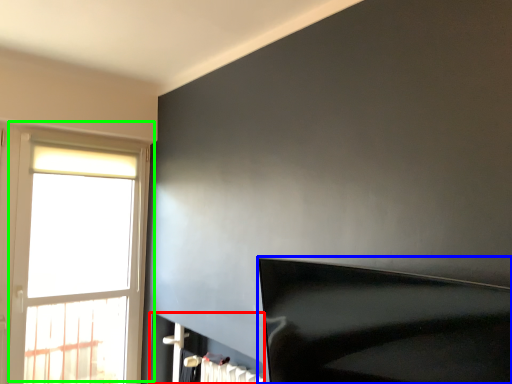
Question: Based on their relative distances, which object is farther from fireplace (highlighted by a red box)? Choose from furniture (highlighted by a blue box) and window (highlighted by a green box).

Choices:
 (A) furniture
 (B) window

Answer: (A)